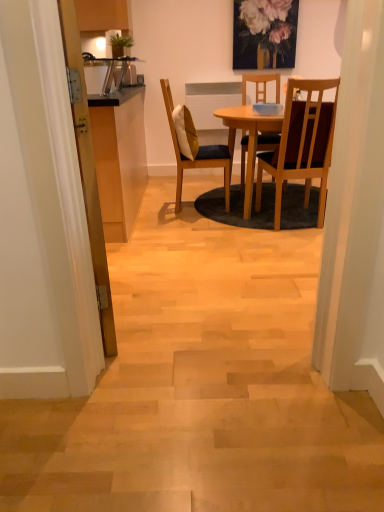
Measure the distance between wooden chair with cushion at center, positioned as the second chair in right-to-left order, and camera.

wooden chair with cushion at center, positioned as the second chair in right-to-left order, and camera are 3.08 meters apart from each other.

Image resolution: width=384 pixels, height=512 pixels. Identify the location of brown wooden chair at center, marked as the second chair in a left-to-right arrangement. (302, 144).

Visually, is wooden door at left positioned to the left or to the right of brown wooden chair at center, marked as the second chair in a left-to-right arrangement?

From the image, it's evident that wooden door at left is to the left of brown wooden chair at center, marked as the second chair in a left-to-right arrangement.

Is wooden door at left positioned in front of brown wooden chair at center, which ranks as the first chair in right-to-left order?

Yes, wooden door at left is closer to the viewer.

Starting from the wooden door at left, which chair is the 2nd one to the right? Please provide its 2D coordinates.

[(302, 144)]

Is wooden door at left smaller than brown wooden chair at center, marked as the second chair in a left-to-right arrangement?

Yes.

Which is less distant, (192, 147) or (248, 183)?

Point (192, 147).

Is yellow fabric pillow at center positioned with its back to light brown wooden table at center?

No, light brown wooden table at center is not at the back of yellow fabric pillow at center.

Measure the distance from yellow fabric pillow at center to light brown wooden table at center.

yellow fabric pillow at center and light brown wooden table at center are 15.57 inches apart from each other.

Choose the correct answer: Is yellow fabric pillow at center inside light brown wooden table at center or outside it?

yellow fabric pillow at center exists outside the volume of light brown wooden table at center.

Is brown wooden chair at center, marked as the second chair in a left-to-right arrangement, aimed at light brown wooden table at center?

Yes.

Considering the points (294, 146) and (252, 117), which point is behind, point (294, 146) or point (252, 117)?

The point (252, 117) is more distant.

From a real-world perspective, which is physically above, brown wooden chair at center, marked as the second chair in a left-to-right arrangement, or light brown wooden table at center?

brown wooden chair at center, marked as the second chair in a left-to-right arrangement.

Is brown wooden chair at center, marked as the second chair in a left-to-right arrangement, next to light brown wooden table at center and touching it?

brown wooden chair at center, marked as the second chair in a left-to-right arrangement, is not next to light brown wooden table at center, and they're not touching.

Is brown wooden chair at center, which ranks as the first chair in right-to-left order, touching wooden chair with cushion at center, the first chair when ordered from left to right?

No, brown wooden chair at center, which ranks as the first chair in right-to-left order, is not beside wooden chair with cushion at center, the first chair when ordered from left to right.

Does brown wooden chair at center, which ranks as the first chair in right-to-left order, have a greater height compared to wooden chair with cushion at center, positioned as the second chair in right-to-left order?

Incorrect, the height of brown wooden chair at center, which ranks as the first chair in right-to-left order, is not larger of that of wooden chair with cushion at center, positioned as the second chair in right-to-left order.

Does point (321, 216) lie in front of point (217, 166)?

Yes, point (321, 216) is in front of point (217, 166).

Where is `chair located in front of the wooden chair with cushion at center, the first chair when ordered from left to right`? The image size is (384, 512). chair located in front of the wooden chair with cushion at center, the first chair when ordered from left to right is located at coordinates (302, 144).

In the scene shown: Is brown wooden chair at center, marked as the second chair in a left-to-right arrangement, located within light brown wooden table at center?

That's correct, brown wooden chair at center, marked as the second chair in a left-to-right arrangement, is inside light brown wooden table at center.

How many degrees apart are the facing directions of light brown wooden table at center and brown wooden chair at center, marked as the second chair in a left-to-right arrangement?

90.5 degrees.

Which is in front, point (248, 121) or point (311, 103)?

The point (311, 103) is more forward.

From a real-world perspective, is light brown wooden table at center under brown wooden chair at center, marked as the second chair in a left-to-right arrangement?

Correct, in the physical world, light brown wooden table at center is lower than brown wooden chair at center, marked as the second chair in a left-to-right arrangement.

Considering the sizes of objects light brown wooden table at center and yellow fabric pillow at center in the image provided, who is bigger, light brown wooden table at center or yellow fabric pillow at center?

Bigger between the two is light brown wooden table at center.

Which of these two, light brown wooden table at center or yellow fabric pillow at center, is thinner?

Thinner between the two is yellow fabric pillow at center.

From a real-world perspective, between light brown wooden table at center and yellow fabric pillow at center, who is vertically higher?

yellow fabric pillow at center is physically above.

Can you confirm if brown wooden chair at center, which ranks as the first chair in right-to-left order, is positioned to the right of wooden door at left?

Correct, you'll find brown wooden chair at center, which ranks as the first chair in right-to-left order, to the right of wooden door at left.

Looking at this image, which is behind, brown wooden chair at center, marked as the second chair in a left-to-right arrangement, or wooden door at left?

brown wooden chair at center, marked as the second chair in a left-to-right arrangement, is more distant.

From a real-world perspective, count 1st chairs downward from the wooden door at left and point to it. Please provide its 2D coordinates.

[(302, 144)]

Is brown wooden chair at center, marked as the second chair in a left-to-right arrangement, oriented towards wooden door at left?

No, brown wooden chair at center, marked as the second chair in a left-to-right arrangement, is not facing towards wooden door at left.

This screenshot has height=512, width=384. I want to click on door below the brown wooden chair at center, marked as the second chair in a left-to-right arrangement (from the image's perspective), so click(x=88, y=175).

Locate an element on the screen. round table in front of the yellow fabric pillow at center is located at coordinates (249, 139).

Looking at the image, which one is located further to yellow fabric pillow at center, light brown wooden table at center or brown wooden chair at center, which ranks as the first chair in right-to-left order?

brown wooden chair at center, which ranks as the first chair in right-to-left order, is positioned further to the anchor yellow fabric pillow at center.

Estimate the real-world distances between objects in this image. Which object is closer to brown wooden chair at center, marked as the second chair in a left-to-right arrangement, yellow fabric pillow at center or wooden chair with cushion at center, the first chair when ordered from left to right?

Among the two, wooden chair with cushion at center, the first chair when ordered from left to right, is located nearer to brown wooden chair at center, marked as the second chair in a left-to-right arrangement.

When comparing their distances from wooden door at left, does light brown wooden table at center or brown wooden chair at center, which ranks as the first chair in right-to-left order, seem further?

brown wooden chair at center, which ranks as the first chair in right-to-left order, is positioned further to the anchor wooden door at left.

Estimate the real-world distances between objects in this image. Which object is further from wooden chair with cushion at center, the first chair when ordered from left to right, brown wooden chair at center, marked as the second chair in a left-to-right arrangement, or yellow fabric pillow at center?

brown wooden chair at center, marked as the second chair in a left-to-right arrangement, is positioned further to the anchor wooden chair with cushion at center, the first chair when ordered from left to right.

When comparing their distances from brown wooden chair at center, which ranks as the first chair in right-to-left order, does light brown wooden table at center or wooden chair with cushion at center, the first chair when ordered from left to right, seem closer?

Based on the image, light brown wooden table at center appears to be nearer to brown wooden chair at center, which ranks as the first chair in right-to-left order.

Estimate the real-world distances between objects in this image. Which object is further from brown wooden chair at center, marked as the second chair in a left-to-right arrangement, wooden door at left or light brown wooden table at center?

wooden door at left is positioned further to the anchor brown wooden chair at center, marked as the second chair in a left-to-right arrangement.

Which object lies further to the anchor point yellow fabric pillow at center, wooden door at left or brown wooden chair at center, marked as the second chair in a left-to-right arrangement?

The object further to yellow fabric pillow at center is wooden door at left.

When comparing their distances from wooden chair with cushion at center, the first chair when ordered from left to right, does wooden door at left or light brown wooden table at center seem closer?

light brown wooden table at center is positioned closer to the anchor wooden chair with cushion at center, the first chair when ordered from left to right.

I want to click on chair between wooden chair with cushion at center, the first chair when ordered from left to right, and light brown wooden table at center, so click(x=302, y=144).

Locate an element on the screen. round table positioned between wooden door at left and yellow fabric pillow at center from near to far is located at coordinates (249, 139).

Image resolution: width=384 pixels, height=512 pixels. Find the location of `round table positioned between wooden door at left and wooden chair with cushion at center, positioned as the second chair in right-to-left order, from near to far`. round table positioned between wooden door at left and wooden chair with cushion at center, positioned as the second chair in right-to-left order, from near to far is located at coordinates (249, 139).

Locate an element on the screen. This screenshot has width=384, height=512. chair situated between yellow fabric pillow at center and brown wooden chair at center, marked as the second chair in a left-to-right arrangement, from left to right is located at coordinates (197, 154).